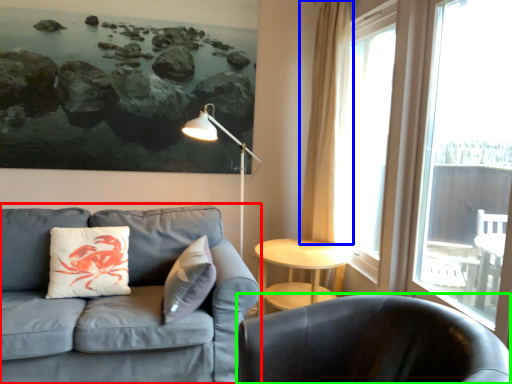
Question: Which object is positioned closest to studio couch (highlighted by a red box)? Select from curtain (highlighted by a blue box) and chair (highlighted by a green box).

Choices:
 (A) curtain
 (B) chair

Answer: (B)